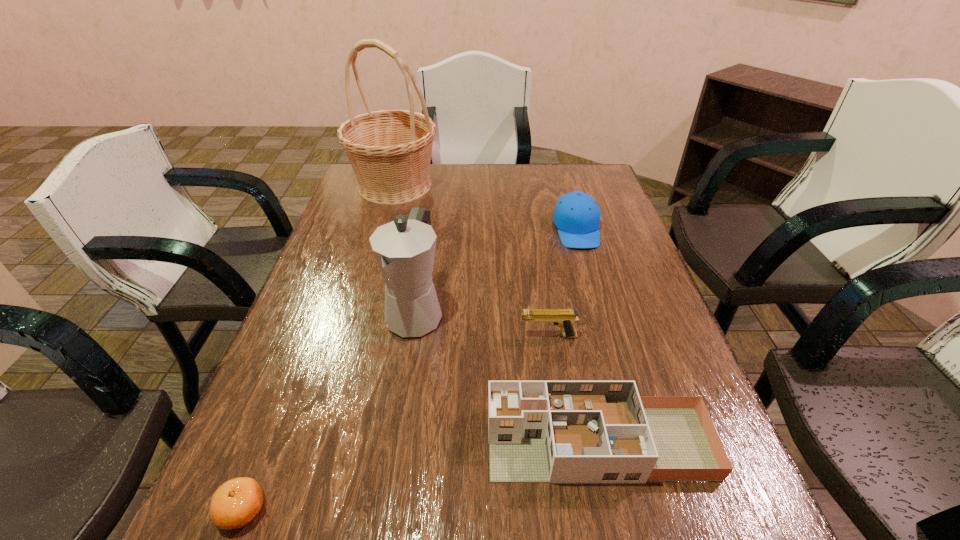
Where is `vacant area between the nearest object and the tallest object`? vacant area between the nearest object and the tallest object is located at coordinates (319, 348).

Locate an element on the screen. vacant area between the fifth nearest object and the pistol is located at coordinates (563, 283).

Where is `object that is the third closest to the basket`? This screenshot has width=960, height=540. object that is the third closest to the basket is located at coordinates (564, 318).

Locate which object is the second closest to the coffeepot. Please provide its 2D coordinates. Your answer should be formatted as a tuple, i.e. [(x, y)], where the tuple contains the x and y coordinates of a point satisfying the conditions above.

[(538, 431)]

Identify the location of free location that satisfies the following two spatial constraints: 1. on the back side of the nearest object; 2. on the right side of the tallest object. (368, 185).